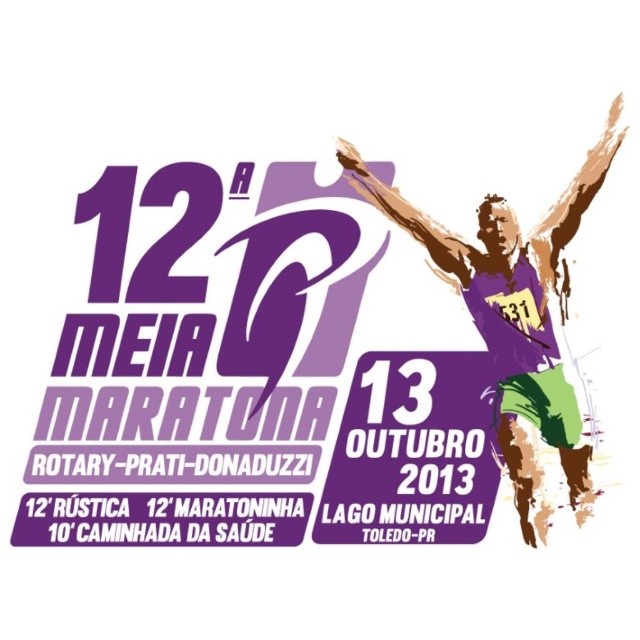
Based on the photo, measure the distance between point (502, 314) and camera.

Point (502, 314) and camera are 1.19 meters apart.

Describe the element at coordinates (515, 317) in the screenshot. I see `purple matte jersey at upper right` at that location.

I want to click on purple matte jersey at upper right, so pos(515,317).